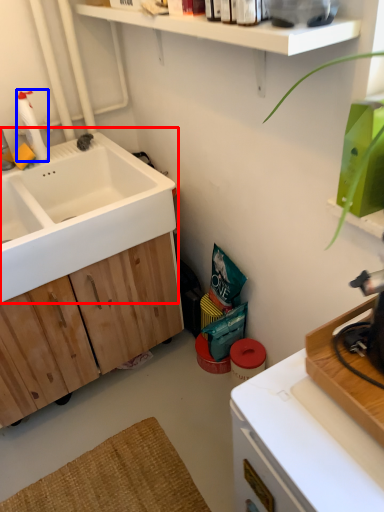
Question: Which object appears closest to the camera in this image, sink (highlighted by a red box) or cleaning product (highlighted by a blue box)?

Choices:
 (A) sink
 (B) cleaning product

Answer: (A)